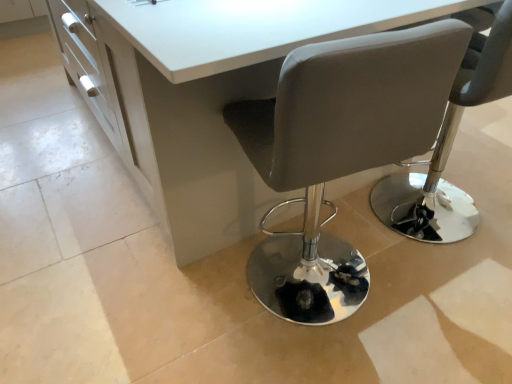
Question: From the image's perspective, does matte gray chair at center, the first chair from the right, appear higher than white glossy table at center?

Choices:
 (A) yes
 (B) no

Answer: (B)

Question: Considering the relative sizes of matte gray chair at center, the second chair in the left-to-right sequence, and white glossy table at center in the image provided, is matte gray chair at center, the second chair in the left-to-right sequence, bigger than white glossy table at center?

Choices:
 (A) yes
 (B) no

Answer: (B)

Question: Is matte gray chair at center, the first chair from the right, taller than white glossy table at center?

Choices:
 (A) yes
 (B) no

Answer: (A)

Question: Is matte gray chair at center, the second chair in the left-to-right sequence, wider than white glossy table at center?

Choices:
 (A) yes
 (B) no

Answer: (B)

Question: Is matte gray chair at center, the first chair from the right, facing towards white glossy table at center?

Choices:
 (A) yes
 (B) no

Answer: (A)

Question: Is matte gray chair at center, the first chair from the right, positioned with its back to white glossy table at center?

Choices:
 (A) no
 (B) yes

Answer: (B)

Question: Is matte gray chair at center, marked as the first chair in a left-to-right arrangement, not inside matte gray chair at center, the first chair from the right?

Choices:
 (A) no
 (B) yes

Answer: (B)

Question: Considering the relative sizes of matte gray chair at center, marked as the first chair in a left-to-right arrangement, and matte gray chair at center, the first chair from the right, in the image provided, is matte gray chair at center, marked as the first chair in a left-to-right arrangement, wider than matte gray chair at center, the first chair from the right,?

Choices:
 (A) no
 (B) yes

Answer: (A)

Question: Can you confirm if matte gray chair at center, marked as the first chair in a left-to-right arrangement, is positioned to the right of matte gray chair at center, the first chair from the right?

Choices:
 (A) yes
 (B) no

Answer: (B)

Question: Can you confirm if matte gray chair at center, marked as the first chair in a left-to-right arrangement, is positioned to the left of matte gray chair at center, the first chair from the right?

Choices:
 (A) no
 (B) yes

Answer: (B)

Question: Is matte gray chair at center, which is the 2th chair in right-to-left order, facing away from matte gray chair at center, the first chair from the right?

Choices:
 (A) yes
 (B) no

Answer: (B)

Question: Does matte gray chair at center, marked as the first chair in a left-to-right arrangement, have a lesser height compared to white glossy table at center?

Choices:
 (A) no
 (B) yes

Answer: (A)